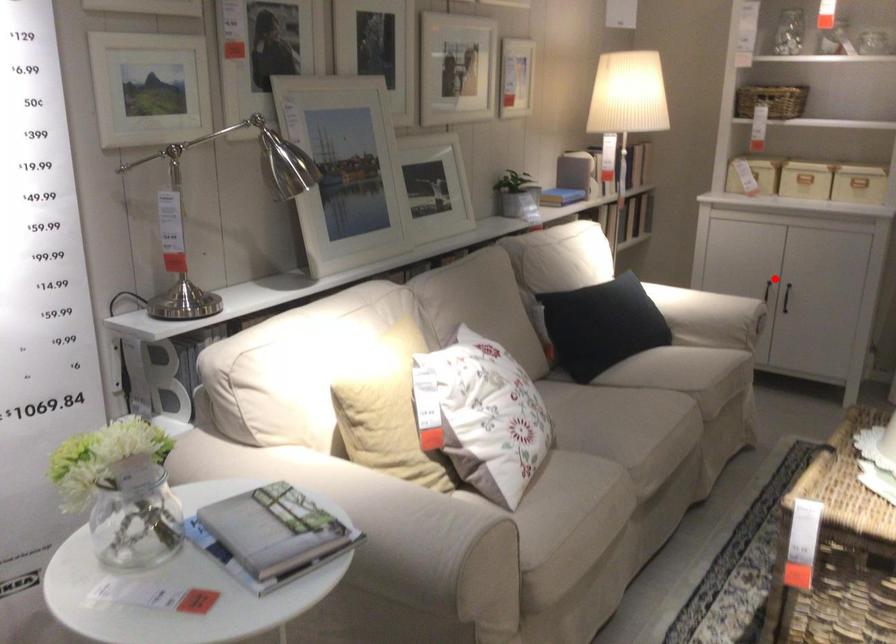
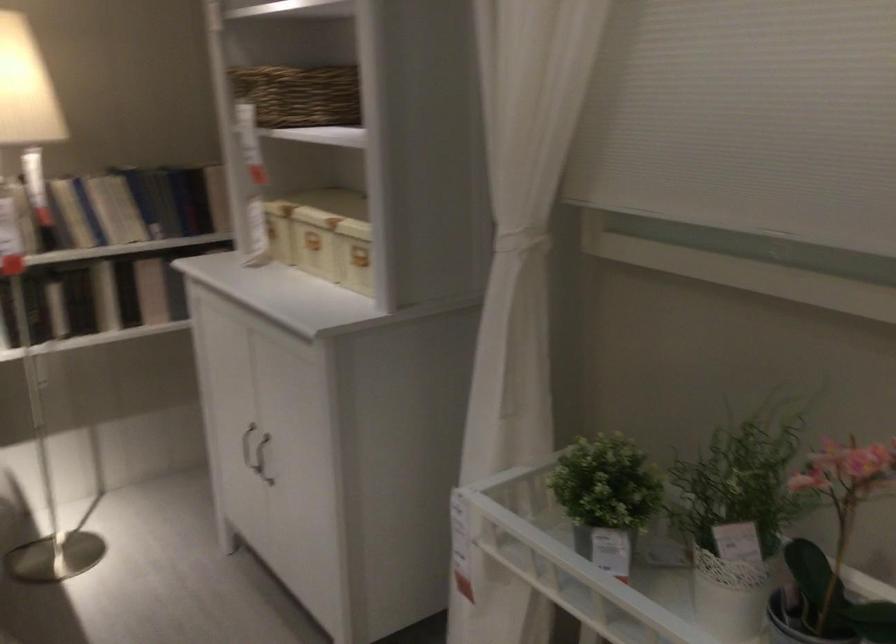
In the second image, find the point that corresponds to the highlighted location in the first image.

(247, 446)